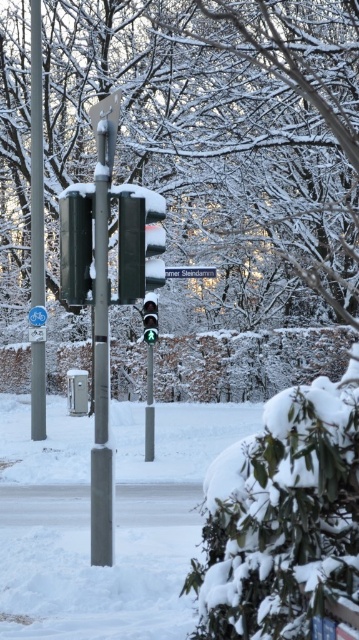
You are standing at the center of the image. Which direction should you look to see the smooth metallic pole at left?

The smooth metallic pole at left is located at point (36, 161), so you should look to the left side of the image to see it.

You are a city planner reviewing this winter scene. You need to determine if the smooth metallic pole at left can support a new additional traffic light. The existing white plastic street sign at center is already attached to it. Based on the scene description, can you confirm if the pole is large enough to accommodate another traffic light?

The smooth metallic pole at left is larger in size than the white plastic street sign at center. Since the pole is bigger, it likely has the structural capacity to support an additional traffic light, provided the weight and balance are considered.